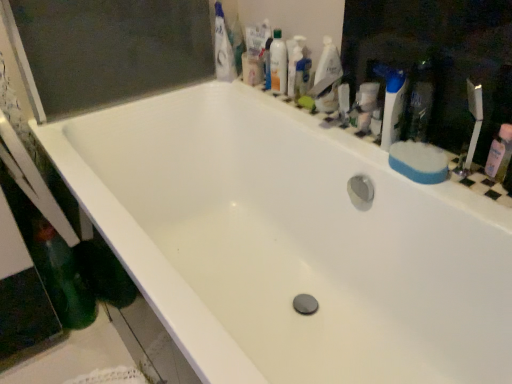
Question: From the image's perspective, is pink plastic mouthwash at right, the 1th mouthwash positioned from the bottom, below translucent plastic mouthwash at upper right, the 1th mouthwash positioned from the left?

Choices:
 (A) no
 (B) yes

Answer: (B)

Question: Is pink plastic mouthwash at right, which is counted as the 3th mouthwash, starting from the back, closer to the viewer compared to translucent plastic mouthwash at upper right, which ranks as the 1th mouthwash in back-to-front order?

Choices:
 (A) no
 (B) yes

Answer: (B)

Question: Could you tell me if pink plastic mouthwash at right, the 1th mouthwash positioned from the bottom, is facing translucent plastic mouthwash at upper right, positioned as the first mouthwash in top-to-bottom order?

Choices:
 (A) yes
 (B) no

Answer: (B)

Question: Can you confirm if pink plastic mouthwash at right, the 1th mouthwash positioned from the bottom, is taller than translucent plastic mouthwash at upper right, marked as the third mouthwash in a right-to-left arrangement?

Choices:
 (A) yes
 (B) no

Answer: (B)

Question: Is pink plastic mouthwash at right, the 3th mouthwash when ordered from top to bottom, looking in the opposite direction of translucent plastic mouthwash at upper right, which ranks as the 1th mouthwash in back-to-front order?

Choices:
 (A) yes
 (B) no

Answer: (B)

Question: In terms of size, does pink plastic mouthwash at right, the 3th mouthwash when ordered from top to bottom, appear bigger or smaller than translucent plastic mouthwash at upper right, the second mouthwash in the front-to-back sequence?

Choices:
 (A) small
 (B) big

Answer: (A)

Question: Is pink plastic mouthwash at right, which ranks as the 3th mouthwash in left-to-right order, to the left or to the right of translucent plastic mouthwash at upper right, which is the 2th mouthwash from top to bottom, in the image?

Choices:
 (A) left
 (B) right

Answer: (B)

Question: Does point (x=492, y=173) appear closer or farther from the camera than point (x=296, y=34)?

Choices:
 (A) farther
 (B) closer

Answer: (B)

Question: Considering the positions of pink plastic mouthwash at right, which is counted as the 3th mouthwash, starting from the back, and translucent plastic mouthwash at upper right, the second mouthwash in the front-to-back sequence, in the image, is pink plastic mouthwash at right, which is counted as the 3th mouthwash, starting from the back, taller or shorter than translucent plastic mouthwash at upper right, the second mouthwash in the front-to-back sequence,?

Choices:
 (A) short
 (B) tall

Answer: (A)

Question: Is blue plastic toothbrush at upper right in front of or behind translucent plastic mouthwash at upper right, the 2th mouthwash in the left-to-right sequence, in the image?

Choices:
 (A) front
 (B) behind

Answer: (A)

Question: Is point (380, 139) positioned closer to the camera than point (291, 46)?

Choices:
 (A) closer
 (B) farther

Answer: (A)

Question: Looking at the image, does blue plastic toothbrush at upper right seem bigger or smaller compared to translucent plastic mouthwash at upper right, the second mouthwash in the front-to-back sequence?

Choices:
 (A) big
 (B) small

Answer: (A)

Question: Based on their positions, is blue plastic toothbrush at upper right located to the left or right of translucent plastic mouthwash at upper right, the second mouthwash in the front-to-back sequence?

Choices:
 (A) right
 (B) left

Answer: (A)

Question: Looking at the image, does green matte bottle at lower left seem bigger or smaller compared to translucent plastic mouthwash at upper right, which is the 2th mouthwash from top to bottom?

Choices:
 (A) small
 (B) big

Answer: (B)

Question: Is point (35, 243) positioned closer to the camera than point (287, 46)?

Choices:
 (A) farther
 (B) closer

Answer: (B)